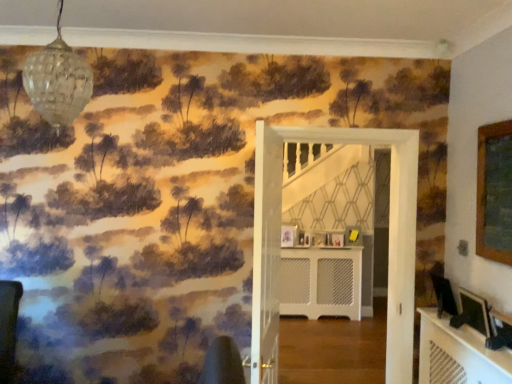
Question: From a real-world perspective, is matte black picture frame at lower right, which is the fourth picture frame in left-to-right order, physically above wooden picture frame at center, placed as the 3th picture frame when sorted from left to right?

Choices:
 (A) yes
 (B) no

Answer: (A)

Question: Is matte black picture frame at lower right, the second picture frame in the right-to-left sequence, facing towards wooden picture frame at center, which is the 3th picture frame in front-to-back order?

Choices:
 (A) yes
 (B) no

Answer: (B)

Question: Considering the relative positions of matte black picture frame at lower right, the first picture frame positioned from the front, and wooden picture frame at center, which is the 3th picture frame in right-to-left order, in the image provided, is matte black picture frame at lower right, the first picture frame positioned from the front, to the left of wooden picture frame at center, which is the 3th picture frame in right-to-left order, from the viewer's perspective?

Choices:
 (A) no
 (B) yes

Answer: (A)

Question: Is the depth of matte black picture frame at lower right, the first picture frame positioned from the front, greater than that of wooden picture frame at center, which is the 3th picture frame in right-to-left order?

Choices:
 (A) yes
 (B) no

Answer: (B)

Question: Can you confirm if matte black picture frame at lower right, the second picture frame in the right-to-left sequence, is shorter than wooden picture frame at center, which is the 3th picture frame in front-to-back order?

Choices:
 (A) no
 (B) yes

Answer: (A)

Question: Is matte black picture frame at lower right, the fifth picture frame viewed from the back, outside wooden picture frame at center, which is the 3th picture frame in front-to-back order?

Choices:
 (A) yes
 (B) no

Answer: (A)

Question: From the image's perspective, is yellow matte picture frame at center, arranged as the 5th picture frame when viewed from the left, on white wooden door at center, the first door positioned from the back?

Choices:
 (A) no
 (B) yes

Answer: (A)

Question: From the image's perspective, is yellow matte picture frame at center, the 1th picture frame viewed from the back, under white wooden door at center, placed as the first door when sorted from right to left?

Choices:
 (A) no
 (B) yes

Answer: (B)

Question: Can you confirm if yellow matte picture frame at center, marked as the fifth picture frame in a front-to-back arrangement, is smaller than white wooden door at center, which ranks as the second door in left-to-right order?

Choices:
 (A) no
 (B) yes

Answer: (B)

Question: Is yellow matte picture frame at center, marked as the fifth picture frame in a front-to-back arrangement, next to white wooden door at center, the second door when ordered from front to back?

Choices:
 (A) no
 (B) yes

Answer: (A)

Question: Does yellow matte picture frame at center, arranged as the 5th picture frame when viewed from the left, have a larger size compared to white wooden door at center, the second door when ordered from front to back?

Choices:
 (A) yes
 (B) no

Answer: (B)

Question: Is wooden picture frame at center, the second picture frame viewed from the back, far away from clear glass globe at upper left?

Choices:
 (A) no
 (B) yes

Answer: (B)